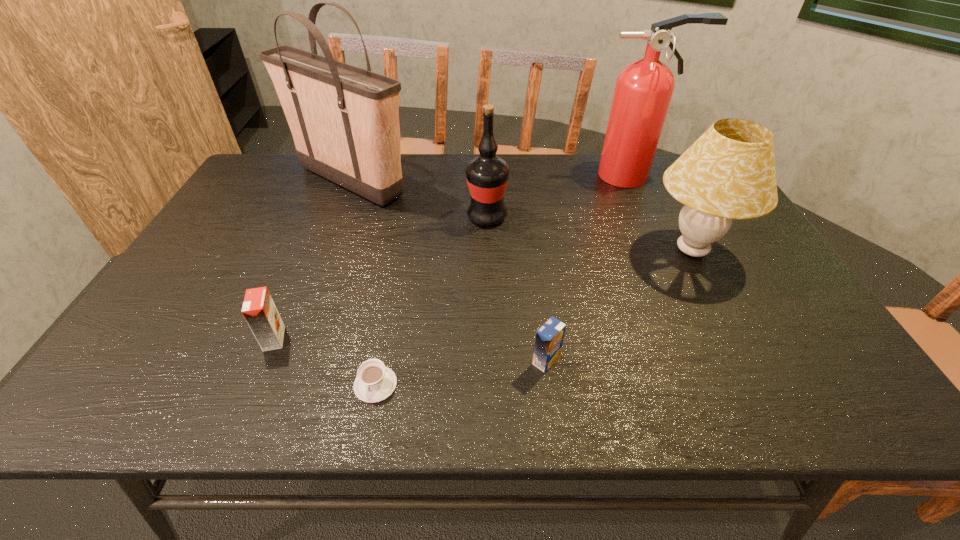
Where is `free space between the teacup and the lampshade`? free space between the teacup and the lampshade is located at coordinates (534, 318).

I want to click on vacant space that is in between the lampshade and the wine bottle, so click(x=589, y=234).

Locate an element on the screen. This screenshot has height=540, width=960. vacant area that lies between the shortest object and the fire extinguisher is located at coordinates (504, 280).

Identify the location of unoccupied position between the fifth tallest object and the fire extinguisher. (453, 257).

Image resolution: width=960 pixels, height=540 pixels. Identify the location of vacant space that is in between the lampshade and the shorter orange_juice. (619, 306).

Find the location of `free space between the wine bottle and the shopping bag`. free space between the wine bottle and the shopping bag is located at coordinates tap(420, 199).

Identify the location of empty space between the left orange_juice and the shopping bag. (313, 260).

Find the location of a particular element. vacant space that is in between the second shortest object and the shopping bag is located at coordinates (448, 271).

Select which object appears as the fifth closest to the fifth tallest object. Please provide its 2D coordinates. Your answer should be formatted as a tuple, i.e. [(x, y)], where the tuple contains the x and y coordinates of a point satisfying the conditions above.

[(729, 173)]

Identify the location of object that can be found as the sixth closest to the taller orange_juice. The width and height of the screenshot is (960, 540). (643, 91).